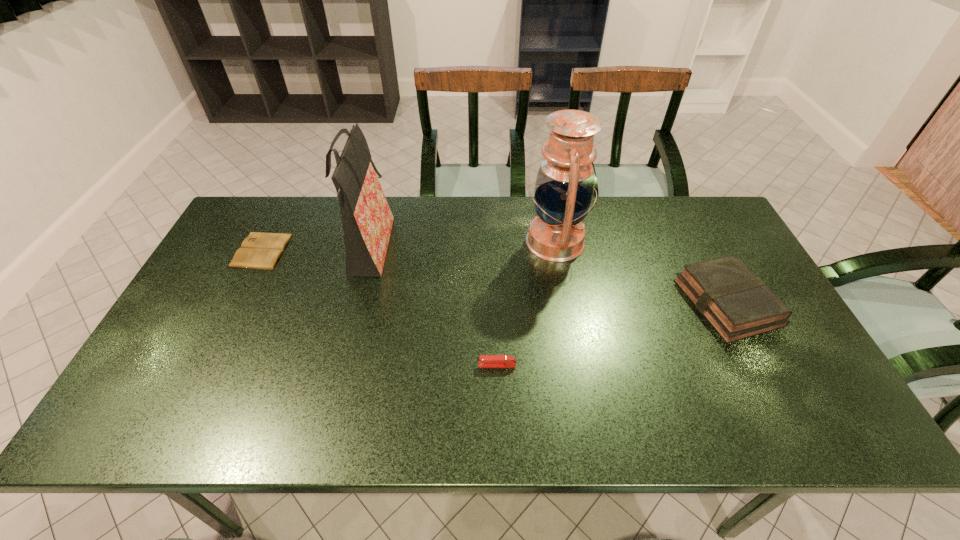
In order to click on vacant space that is in between the shorter book and the oil lamp in this screenshot , I will do `click(409, 246)`.

Identify the location of vacant space that's between the fourth object from left to right and the right book. The image size is (960, 540). (641, 272).

The image size is (960, 540). In order to click on free space between the third object from right to left and the right book in this screenshot , I will do `click(612, 334)`.

I want to click on vacant space that's between the oil lamp and the shortest object, so click(x=409, y=246).

Where is `unoccupied area between the second object from left to right and the fourth tallest object`? The height and width of the screenshot is (540, 960). unoccupied area between the second object from left to right and the fourth tallest object is located at coordinates (433, 307).

Choose which object is the second nearest neighbor to the shopping bag. Please provide its 2D coordinates. Your answer should be formatted as a tuple, i.e. [(x, y)], where the tuple contains the x and y coordinates of a point satisfying the conditions above.

[(485, 361)]

Locate an element on the screen. This screenshot has width=960, height=540. object that can be found as the closest to the oil lamp is located at coordinates (734, 300).

Locate an element on the screen. This screenshot has width=960, height=540. blank area in the image that satisfies the following two spatial constraints: 1. on the front side of the taller book; 2. on the front-facing side of the stapler is located at coordinates (759, 365).

Where is `free space that satisfies the following two spatial constraints: 1. on the front side of the rightmost object; 2. on the left side of the fourth object from right to left`? free space that satisfies the following two spatial constraints: 1. on the front side of the rightmost object; 2. on the left side of the fourth object from right to left is located at coordinates (355, 302).

Where is `free space in the image that satisfies the following two spatial constraints: 1. on the front side of the taller book; 2. on the front-facing side of the third object from left to right`? free space in the image that satisfies the following two spatial constraints: 1. on the front side of the taller book; 2. on the front-facing side of the third object from left to right is located at coordinates (759, 365).